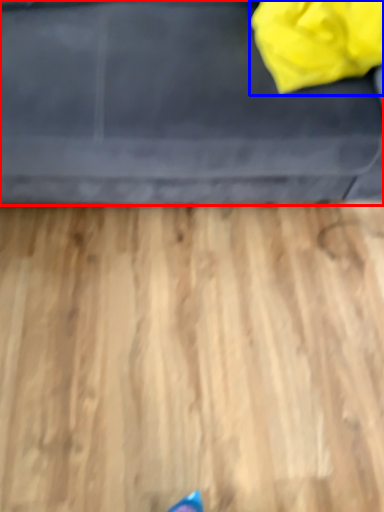
Question: Which of the following is the farthest to the observer, furniture (highlighted by a red box) or bag (highlighted by a blue box)?

Choices:
 (A) furniture
 (B) bag

Answer: (B)